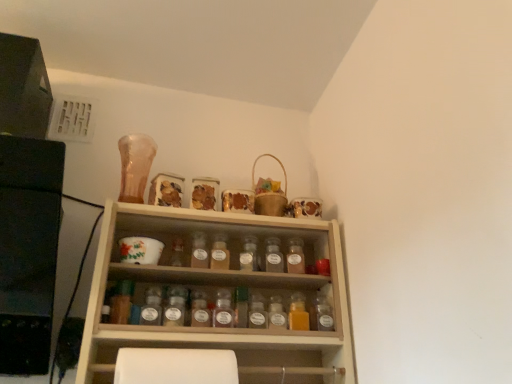
Question: From a real-world perspective, is translucent glass spice at center, the 6th bottle when ordered from right to left, physically located above or below translucent glass spice jar at center, which ranks as the 10th bottle in right-to-left order?

Choices:
 (A) above
 (B) below

Answer: (A)

Question: Considering the positions of translucent glass spice at center, the 6th bottle when ordered from right to left, and translucent glass spice jar at center, marked as the second bottle in a left-to-right arrangement, in the image, is translucent glass spice at center, the 6th bottle when ordered from right to left, bigger or smaller than translucent glass spice jar at center, marked as the second bottle in a left-to-right arrangement,?

Choices:
 (A) big
 (B) small

Answer: (A)

Question: Which of these objects is positioned closest to the translucent glass bottle at center, the 1th bottle when ordered from left to right?

Choices:
 (A) translucent glass spice at center, arranged as the fifth bottle when viewed from the left
 (B) translucent amber bottle at center, which ranks as the 11th bottle in left-to-right order
 (C) translucent glass spice at center, the ninth bottle from the right
 (D) translucent plastic spice jar at center, which is the eighth bottle from left to right
 (E) translucent glass spice at center, which appears as the sixth bottle when viewed from the left

Answer: (C)

Question: Estimate the real-world distances between objects in this image. Which object is farther from the translucent glass spice jar at center, which appears as the 5th bottle when viewed from the right?

Choices:
 (A) translucent glass spice jar at center, arranged as the 3th bottle when viewed from the right
 (B) translucent glass spice at center, which appears as the sixth bottle when viewed from the left
 (C) translucent plastic spice jar at center, which ranks as the 4th bottle in right-to-left order
 (D) translucent glass spice at center, which appears as the 3th bottle when viewed from the left
 (E) translucent glass spice jar at center, the eighth bottle viewed from the right

Answer: (D)